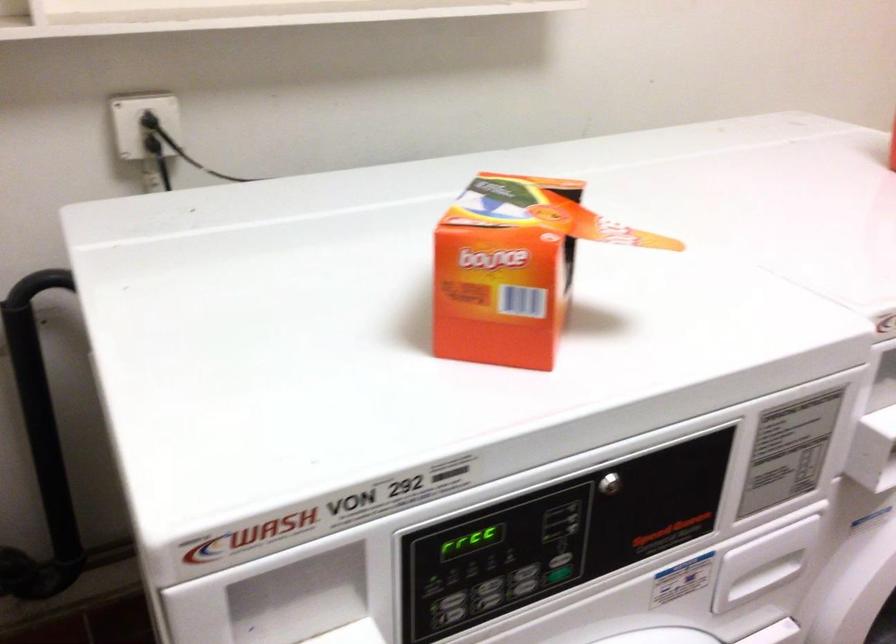
In order to click on orange box flap in this screenshot , I will do `click(502, 287)`.